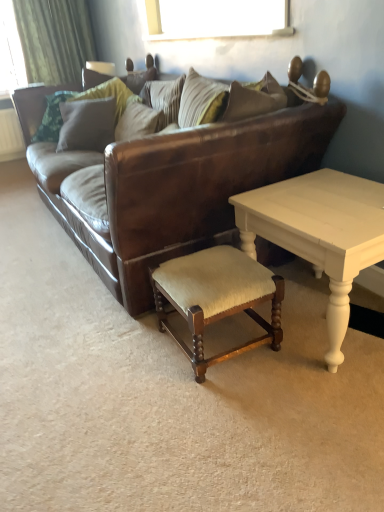
Identify the location of free spot in front of white painted wood coffee table at right. (309, 413).